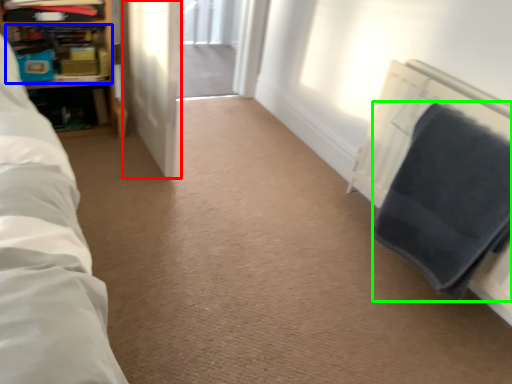
Question: Estimate the real-world distances between objects in this image. Which object is closer to screen door (highlighted by a red box), shelf (highlighted by a blue box) or blanket (highlighted by a green box)?

Choices:
 (A) shelf
 (B) blanket

Answer: (A)